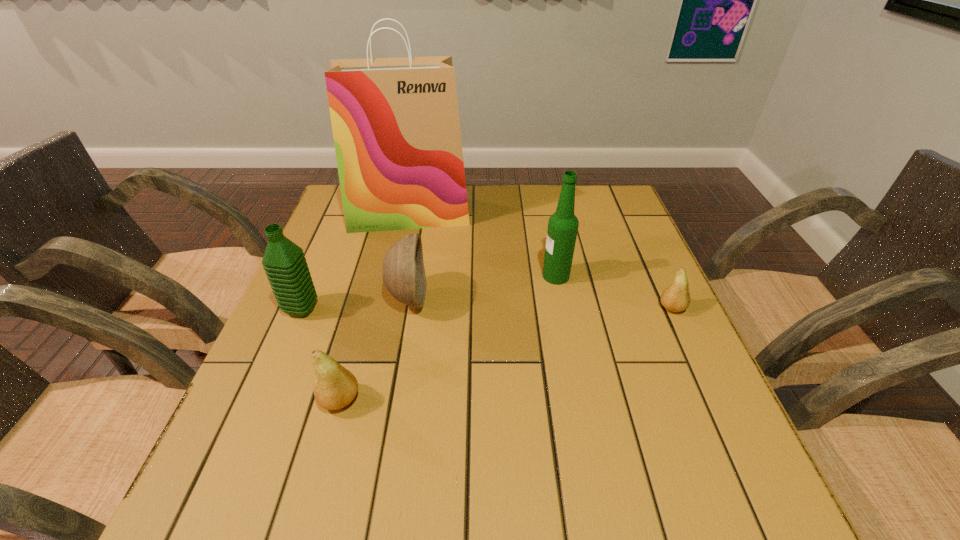
At what (x,y) coordinates should I click in order to perform the action: click on pear present at the left edge. Please return your answer as a coordinate pair (x, y). The width and height of the screenshot is (960, 540). Looking at the image, I should click on (335, 387).

Where is `shopping bag located at the left edge`? The width and height of the screenshot is (960, 540). shopping bag located at the left edge is located at coordinates (395, 121).

Where is `water bottle positioned at the left edge`? This screenshot has height=540, width=960. water bottle positioned at the left edge is located at coordinates (284, 262).

Find the location of a particular element. The width and height of the screenshot is (960, 540). object at the right edge is located at coordinates (676, 298).

Where is `object that is at the far left corner`? The image size is (960, 540). object that is at the far left corner is located at coordinates (395, 121).

Locate an element on the screen. This screenshot has height=540, width=960. object that is at the near left corner is located at coordinates (335, 387).

I want to click on vacant region at the far edge of the desktop, so click(515, 198).

In the image, there is a desktop. Find the location of `vacant space at the near edge`. vacant space at the near edge is located at coordinates (355, 427).

In the image, there is a desktop. Find the location of `vacant space at the left edge`. vacant space at the left edge is located at coordinates (296, 391).

The width and height of the screenshot is (960, 540). In the image, there is a desktop. Find the location of `free region at the right edge`. free region at the right edge is located at coordinates [x=627, y=349].